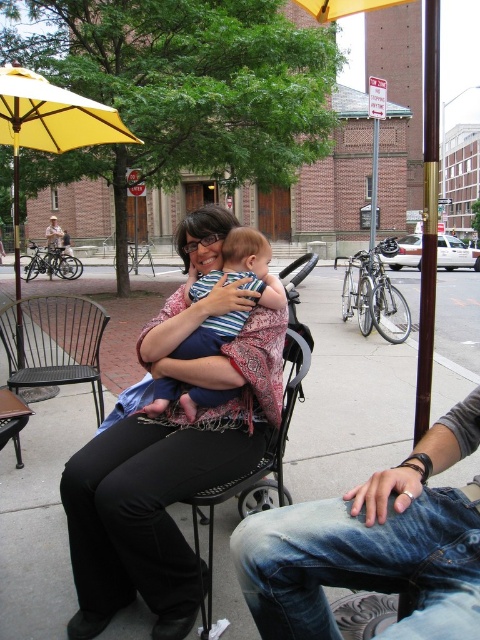
Question: Which object is the farthest from the striped fabric baby at center?

Choices:
 (A) yellow fabric umbrella at upper left
 (B) jeans at lower right
 (C) matte pink shawl at center

Answer: (A)

Question: Where is jeans at lower right located in relation to striped fabric baby at center in the image?

Choices:
 (A) right
 (B) left

Answer: (A)

Question: Is matte pink shawl at center to the right of black metal chair at left from the viewer's perspective?

Choices:
 (A) no
 (B) yes

Answer: (B)

Question: Which of these objects is positioned farthest from the matte pink shawl at center?

Choices:
 (A) yellow fabric umbrella at upper left
 (B) jeans at lower right
 (C) black metal chair at left
 (D) striped fabric baby at center

Answer: (A)

Question: Which point appears farthest from the camera in this image?

Choices:
 (A) (240, 253)
 (B) (197, 486)
 (C) (78, 314)
 (D) (477, 515)

Answer: (C)

Question: Does jeans at lower right lie behind yellow fabric umbrella at upper left?

Choices:
 (A) yes
 (B) no

Answer: (B)